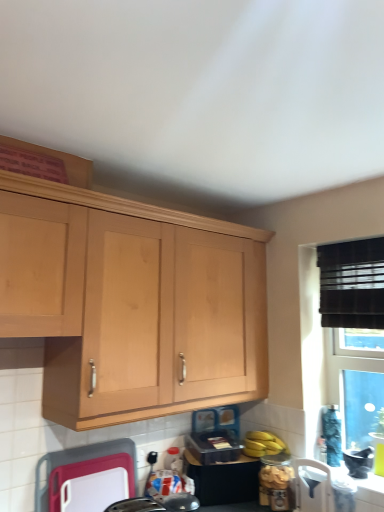
Describe the element at coordinates (277, 482) in the screenshot. This screenshot has height=512, width=384. I see `translucent glass jar at lower right, the 2th appliance in the right-to-left sequence` at that location.

Looking at this image, measure the distance between translucent glass jar at lower right, the 2th appliance in the right-to-left sequence, and camera.

The distance of translucent glass jar at lower right, the 2th appliance in the right-to-left sequence, from camera is 1.85 meters.

Locate an element on the screen. This screenshot has width=384, height=512. white plastic cutting board at lower center, which is counted as the first appliance, starting from the left is located at coordinates tap(78, 462).

You are a GUI agent. You are given a task and a screenshot of the screen. Output one action in this format:
    pyautogui.click(x=<x>, y=<y>)
    Task: Click on the translucent glass jar at lower right, the 2th appliance in the left-to-right sequence
    The image size is (384, 512).
    Given the screenshot: What is the action you would take?
    [277, 482]

From the image's perspective, is white plastic cutting board at lower center, arranged as the 3th appliance when viewed from the right, positioned above or below light wood cabinet at upper left?

Clearly, from the image's perspective, white plastic cutting board at lower center, arranged as the 3th appliance when viewed from the right, is below light wood cabinet at upper left.

Is white plastic cutting board at lower center, arranged as the 3th appliance when viewed from the right, far from light wood cabinet at upper left?

Actually, white plastic cutting board at lower center, arranged as the 3th appliance when viewed from the right, and light wood cabinet at upper left are a little close together.

Does white plastic cutting board at lower center, arranged as the 3th appliance when viewed from the right, have a greater width compared to light wood cabinet at upper left?

No, white plastic cutting board at lower center, arranged as the 3th appliance when viewed from the right, is not wider than light wood cabinet at upper left.

Which is behind, point (120, 443) or point (28, 330)?

The point (120, 443) is behind.

Consider the image. Can you tell me how much light wood cabinet at upper left and white plastic cutting board at lower center, arranged as the 3th appliance when viewed from the right, differ in facing direction?

They differ by 2.27 degrees in their facing directions.

Relative to white plastic cutting board at lower center, arranged as the 3th appliance when viewed from the right, is light wood cabinet at upper left in front or behind?

In the image, light wood cabinet at upper left appears in front of white plastic cutting board at lower center, arranged as the 3th appliance when viewed from the right.

Identify the location of appliance that is the 1st one when counting downward from the light wood cabinet at upper left (from the image's perspective). (78, 462).

Is light wood cabinet at upper left to the left of white plastic cutting board at lower center, arranged as the 3th appliance when viewed from the right, from the viewer's perspective?

Incorrect, light wood cabinet at upper left is not on the left side of white plastic cutting board at lower center, arranged as the 3th appliance when viewed from the right.

Is point (314, 470) positioned behind point (54, 463)?

Yes, point (314, 470) is behind point (54, 463).

Is white plastic chair at lower right, marked as the 1th appliance in a right-to-left arrangement, next to white plastic cutting board at lower center, which is counted as the first appliance, starting from the left?

No, white plastic chair at lower right, marked as the 1th appliance in a right-to-left arrangement, is not beside white plastic cutting board at lower center, which is counted as the first appliance, starting from the left.

Which of these two, white plastic chair at lower right, marked as the 1th appliance in a right-to-left arrangement, or white plastic cutting board at lower center, arranged as the 3th appliance when viewed from the right, stands shorter?

With less height is white plastic chair at lower right, marked as the 1th appliance in a right-to-left arrangement.

How many degrees apart are the facing directions of white plastic cutting board at lower center, arranged as the 3th appliance when viewed from the right, and translucent glass jar at lower right, the 2th appliance in the left-to-right sequence?

The angular difference between white plastic cutting board at lower center, arranged as the 3th appliance when viewed from the right, and translucent glass jar at lower right, the 2th appliance in the left-to-right sequence, is 85.5 degrees.

From a real-world perspective, which object rests below the other?

In real-world perspective, translucent glass jar at lower right, the 2th appliance in the left-to-right sequence, is lower.

Considering the relative positions of white plastic cutting board at lower center, which is counted as the first appliance, starting from the left, and translucent glass jar at lower right, the 2th appliance in the left-to-right sequence, in the image provided, is white plastic cutting board at lower center, which is counted as the first appliance, starting from the left, to the right of translucent glass jar at lower right, the 2th appliance in the left-to-right sequence, from the viewer's perspective?

No, white plastic cutting board at lower center, which is counted as the first appliance, starting from the left, is not to the right of translucent glass jar at lower right, the 2th appliance in the left-to-right sequence.

Is white plastic cutting board at lower center, which is counted as the first appliance, starting from the left, next to translucent glass jar at lower right, the 2th appliance in the right-to-left sequence?

No, white plastic cutting board at lower center, which is counted as the first appliance, starting from the left, is not next to translucent glass jar at lower right, the 2th appliance in the right-to-left sequence.

Considering their positions, is translucent glass jar at lower right, the 2th appliance in the right-to-left sequence, located in front of or behind white plastic cutting board at lower center, which is counted as the first appliance, starting from the left?

Clearly, translucent glass jar at lower right, the 2th appliance in the right-to-left sequence, is behind white plastic cutting board at lower center, which is counted as the first appliance, starting from the left.

From a real-world perspective, is translucent glass jar at lower right, the 2th appliance in the right-to-left sequence, located higher than white plastic cutting board at lower center, arranged as the 3th appliance when viewed from the right?

Result: No, from a real-world perspective, translucent glass jar at lower right, the 2th appliance in the right-to-left sequence, is not above white plastic cutting board at lower center, arranged as the 3th appliance when viewed from the right.

From the image's perspective, is light wood cabinet at upper left on top of translucent glass jar at lower right, the 2th appliance in the left-to-right sequence?

Yes.

Is light wood cabinet at upper left not close to translucent glass jar at lower right, the 2th appliance in the right-to-left sequence?

No, light wood cabinet at upper left is not far from translucent glass jar at lower right, the 2th appliance in the right-to-left sequence.

From a real-world perspective, which is physically above, light wood cabinet at upper left or translucent glass jar at lower right, the 2th appliance in the right-to-left sequence?

In real-world perspective, light wood cabinet at upper left is above.

How different are the orientations of light wood cabinet at upper left and translucent glass jar at lower right, the 2th appliance in the right-to-left sequence, in degrees?

They differ by 87.8 degrees in their facing directions.

Does point (282, 449) come farther from viewer compared to point (107, 207)?

That is True.

From a real-world perspective, between yellow matte bananas at lower right and light wood cabinet at upper left, who is vertically lower?

From a 3D spatial view, yellow matte bananas at lower right is below.

From the picture: From the image's perspective, which is above, yellow matte bananas at lower right or light wood cabinet at upper left?

light wood cabinet at upper left is shown above in the image.

Can you confirm if yellow matte bananas at lower right is positioned to the right of light wood cabinet at upper left?

Indeed, yellow matte bananas at lower right is positioned on the right side of light wood cabinet at upper left.

The width and height of the screenshot is (384, 512). In order to click on the 1st appliance directly beneath the light wood cabinet at upper left (from a real-world perspective) in this screenshot , I will do `click(78, 462)`.

From the image's perspective, count 1st appliances downward from the light wood cabinet at upper left and point to it. Please provide its 2D coordinates.

[(78, 462)]

Considering their positions, is yellow matte bananas at lower right positioned closer to translucent glass jar at lower right, the 2th appliance in the right-to-left sequence, than light wood cabinet at upper left?

Based on the image, yellow matte bananas at lower right appears to be nearer to translucent glass jar at lower right, the 2th appliance in the right-to-left sequence.

Considering their positions, is white plastic chair at lower right, the 3th appliance positioned from the left, positioned further to light wood cabinet at upper left than translucent glass jar at lower right, the 2th appliance in the right-to-left sequence?

white plastic chair at lower right, the 3th appliance positioned from the left, is positioned further to the anchor light wood cabinet at upper left.

From the image, which object appears to be nearer to translucent glass jar at lower right, the 2th appliance in the left-to-right sequence, white plastic cutting board at lower center, arranged as the 3th appliance when viewed from the right, or white plastic chair at lower right, the 3th appliance positioned from the left?

white plastic chair at lower right, the 3th appliance positioned from the left, lies closer to translucent glass jar at lower right, the 2th appliance in the left-to-right sequence, than the other object.

Looking at the image, which one is located closer to light wood cabinet at upper left, white plastic cutting board at lower center, which is counted as the first appliance, starting from the left, or yellow matte bananas at lower right?

Based on the image, white plastic cutting board at lower center, which is counted as the first appliance, starting from the left, appears to be nearer to light wood cabinet at upper left.

When comparing their distances from yellow matte bananas at lower right, does light wood cabinet at upper left or white plastic cutting board at lower center, arranged as the 3th appliance when viewed from the right, seem closer?

white plastic cutting board at lower center, arranged as the 3th appliance when viewed from the right, is positioned closer to the anchor yellow matte bananas at lower right.

Which object lies nearer to the anchor point white plastic chair at lower right, marked as the 1th appliance in a right-to-left arrangement, light wood cabinet at upper left or white plastic cutting board at lower center, which is counted as the first appliance, starting from the left?

Based on the image, light wood cabinet at upper left appears to be nearer to white plastic chair at lower right, marked as the 1th appliance in a right-to-left arrangement.

Considering their positions, is yellow matte bananas at lower right positioned further to light wood cabinet at upper left than translucent glass jar at lower right, the 2th appliance in the left-to-right sequence?

translucent glass jar at lower right, the 2th appliance in the left-to-right sequence.

Based on their spatial positions, is white plastic cutting board at lower center, arranged as the 3th appliance when viewed from the right, or translucent glass jar at lower right, the 2th appliance in the left-to-right sequence, further from white plastic chair at lower right, the 3th appliance positioned from the left?

white plastic cutting board at lower center, arranged as the 3th appliance when viewed from the right, is further to white plastic chair at lower right, the 3th appliance positioned from the left.

Find the location of `appliance between yellow matte bananas at lower right and white plastic chair at lower right, marked as the 1th appliance in a right-to-left arrangement, from left to right`. appliance between yellow matte bananas at lower right and white plastic chair at lower right, marked as the 1th appliance in a right-to-left arrangement, from left to right is located at coordinates (277, 482).

The image size is (384, 512). What are the coordinates of `appliance between white plastic cutting board at lower center, arranged as the 3th appliance when viewed from the right, and white plastic chair at lower right, marked as the 1th appliance in a right-to-left arrangement, in the horizontal direction` in the screenshot? It's located at (277, 482).

Find the location of a particular element. Image resolution: width=384 pixels, height=512 pixels. food between white plastic cutting board at lower center, which is counted as the first appliance, starting from the left, and translucent glass jar at lower right, the 2th appliance in the right-to-left sequence, in the horizontal direction is located at coordinates (263, 444).

This screenshot has width=384, height=512. Identify the location of food that lies between light wood cabinet at upper left and white plastic cutting board at lower center, which is counted as the first appliance, starting from the left, from top to bottom. (263, 444).